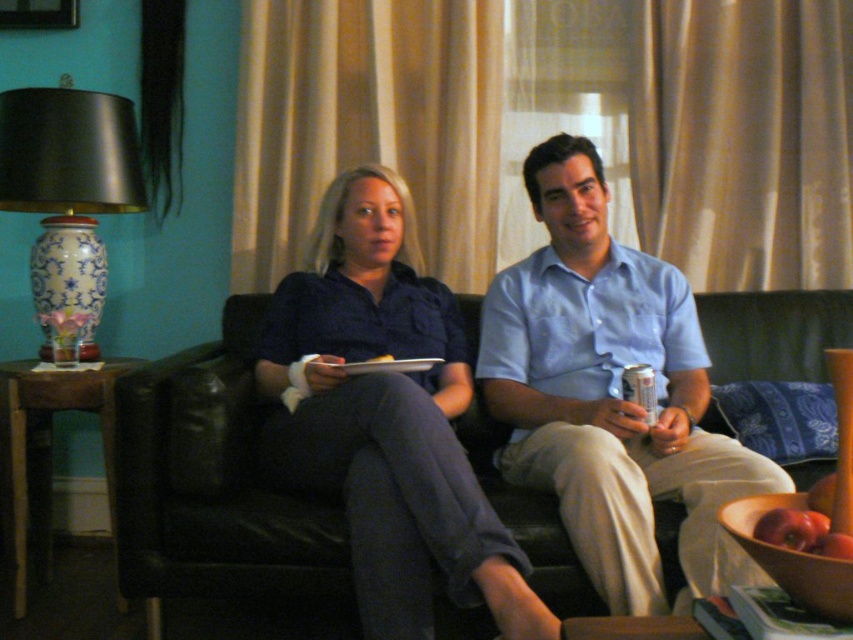
Question: Is light blue cotton shirt at center above blue and white porcelain vase at left?

Choices:
 (A) yes
 (B) no

Answer: (B)

Question: Considering the real-world distances, which object is farthest from the black leather couch at center?

Choices:
 (A) blue and white porcelain vase at left
 (B) light blue cotton shirt at center

Answer: (B)

Question: Can you confirm if matte blue shirt at center is positioned to the right of blue and white porcelain vase at left?

Choices:
 (A) no
 (B) yes

Answer: (B)

Question: Based on their relative distances, which object is farther from the light blue cotton shirt at center?

Choices:
 (A) matte blue shirt at center
 (B) black leather couch at center
 (C) blue and white porcelain vase at left

Answer: (C)

Question: Which object appears farthest from the camera in this image?

Choices:
 (A) matte blue shirt at center
 (B) black leather couch at center
 (C) blue and white porcelain vase at left
 (D) light blue cotton shirt at center

Answer: (C)

Question: Can you confirm if light blue cotton shirt at center is positioned below matte blue shirt at center?

Choices:
 (A) yes
 (B) no

Answer: (B)